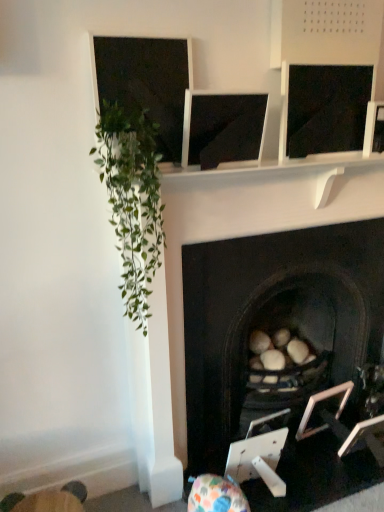
Question: Considering the positions of black stone fireplace at center and metallic silver picture frame at lower right, marked as the 2th picture frame in a right-to-left arrangement, in the image, is black stone fireplace at center taller or shorter than metallic silver picture frame at lower right, marked as the 2th picture frame in a right-to-left arrangement,?

Choices:
 (A) short
 (B) tall

Answer: (B)

Question: Considering their positions, is black stone fireplace at center located in front of or behind metallic silver picture frame at lower right, arranged as the 1th picture frame when viewed from the left?

Choices:
 (A) front
 (B) behind

Answer: (A)

Question: Which object is positioned closest to the metallic silver picture frame at lower right, arranged as the 1th picture frame when viewed from the left?

Choices:
 (A) matte black monitor at center
 (B) wooden swivel chair at lower left
 (C) black stone fireplace at center
 (D) metallic silver picture frame at lower right, which ranks as the second picture frame in left-to-right order
 (E) green leafy plant at left

Answer: (D)

Question: Estimate the real-world distances between objects in this image. Which object is closer to the metallic silver picture frame at lower right, marked as the 2th picture frame in a right-to-left arrangement?

Choices:
 (A) matte black monitor at center
 (B) metallic silver picture frame at lower right, which ranks as the second picture frame in left-to-right order
 (C) wooden swivel chair at lower left
 (D) green leafy plant at left
 (E) black stone fireplace at center

Answer: (B)